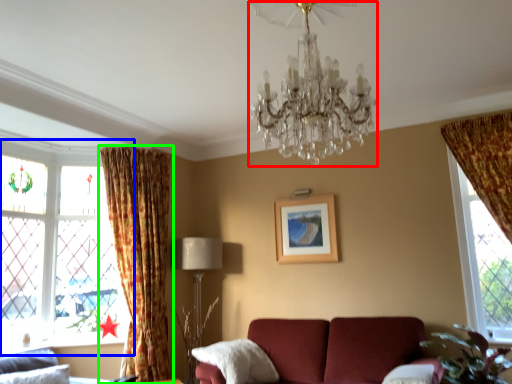
Question: Estimate the real-world distances between objects in this image. Which object is closer to chandelier (highlighted by a red box), window (highlighted by a blue box) or curtain (highlighted by a green box)?

Choices:
 (A) window
 (B) curtain

Answer: (B)